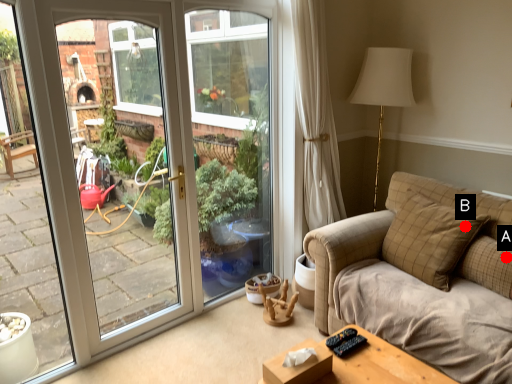
Question: Two points are circled on the image, labeled by A and B beside each circle. Which of the following is the closest to the observer?

Choices:
 (A) A is closer
 (B) B is closer

Answer: (A)